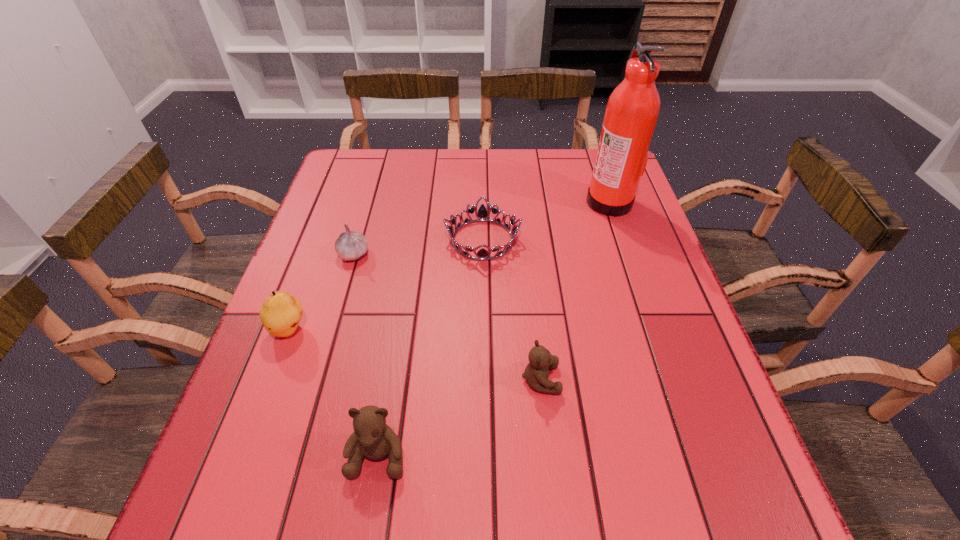
Locate an element on the screen. The width and height of the screenshot is (960, 540). vacant region located 0.110m on the front-facing side of the farther teddy bear is located at coordinates (616, 379).

Where is `vacant position located on the front-facing side of the shortest object`? vacant position located on the front-facing side of the shortest object is located at coordinates (398, 240).

The width and height of the screenshot is (960, 540). What are the coordinates of `free space located 0.050m on the front-facing side of the shortest object` in the screenshot? It's located at (425, 240).

You are a GUI agent. You are given a task and a screenshot of the screen. Output one action in this format:
    pyautogui.click(x=<x>, y=<y>)
    Task: Click on the free space located 0.220m on the front-facing side of the shortest object
    
    Given the screenshot: What is the action you would take?
    [359, 240]

Identify the location of free spot located 0.170m on the label side of the rightmost object. The width and height of the screenshot is (960, 540). (526, 201).

This screenshot has height=540, width=960. I want to click on free space located 0.090m on the label side of the rightmost object, so click(554, 201).

At what (x,y) coordinates should I click in order to perform the action: click on vacant space located 0.050m on the label side of the rightmost object. Please return your answer as a coordinate pair (x, y). Looking at the image, I should click on (568, 201).

The width and height of the screenshot is (960, 540). I want to click on vacant space situated on the back of the garlic, so click(372, 194).

Locate an element on the screen. This screenshot has height=540, width=960. vacant space situated 0.050m on the back of the pear is located at coordinates (301, 297).

Where is `object present at the far edge`? The height and width of the screenshot is (540, 960). object present at the far edge is located at coordinates (632, 110).